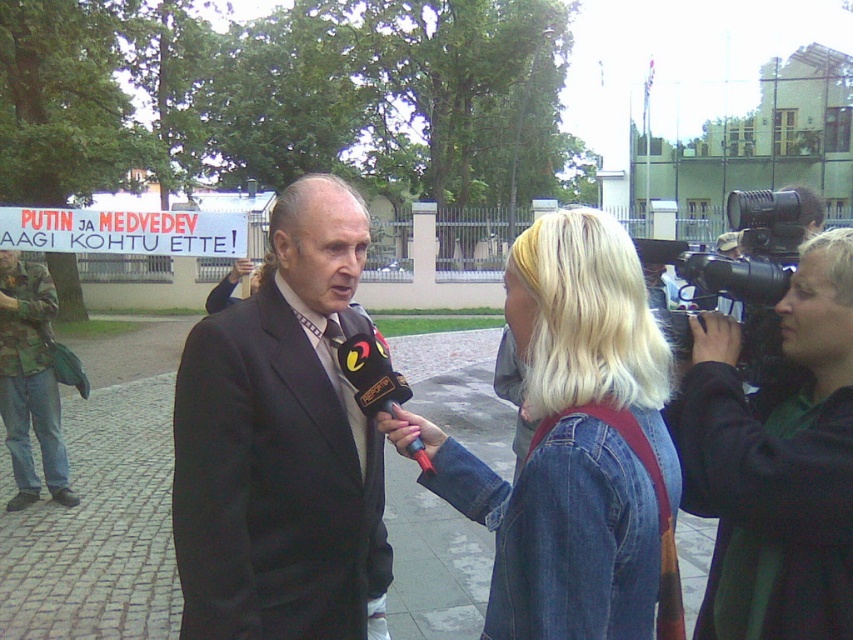
You are a photographer setting up for an event. You need to position a camera so that both the black suit at center and the camouflage fabric jacket at left are visible in the frame. Based on their heights, which object should be placed closer to the camera to ensure both are fully visible?

The black suit at center has a lesser height compared to camouflage fabric jacket at left, so to ensure both are fully visible, the black suit at center should be placed closer to the camera.